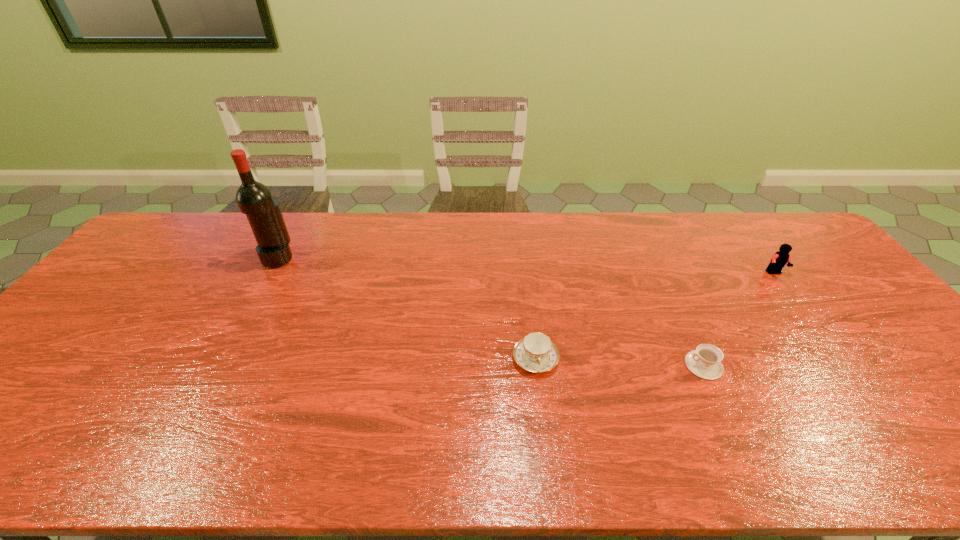
Locate an element on the screen. This screenshot has width=960, height=540. object that can be found as the third closest to the leftmost object is located at coordinates (781, 257).

Select which object is the second closest to the wine bottle. Please provide its 2D coordinates. Your answer should be formatted as a tuple, i.e. [(x, y)], where the tuple contains the x and y coordinates of a point satisfying the conditions above.

[(704, 362)]

Find the location of a particular element. free space that satisfies the following two spatial constraints: 1. on the front-facing side of the second tallest object; 2. on the handle side of the shorter teacup is located at coordinates (846, 366).

What are the coordinates of `free space that satisfies the following two spatial constraints: 1. on the front-facing side of the Lego; 2. on the handle side of the right teacup` in the screenshot? It's located at (846, 366).

This screenshot has width=960, height=540. What are the coordinates of `vacant space that satisfies the following two spatial constraints: 1. on the front-facing side of the rightmost object; 2. on the handle side of the shorter teacup` in the screenshot? It's located at (846, 366).